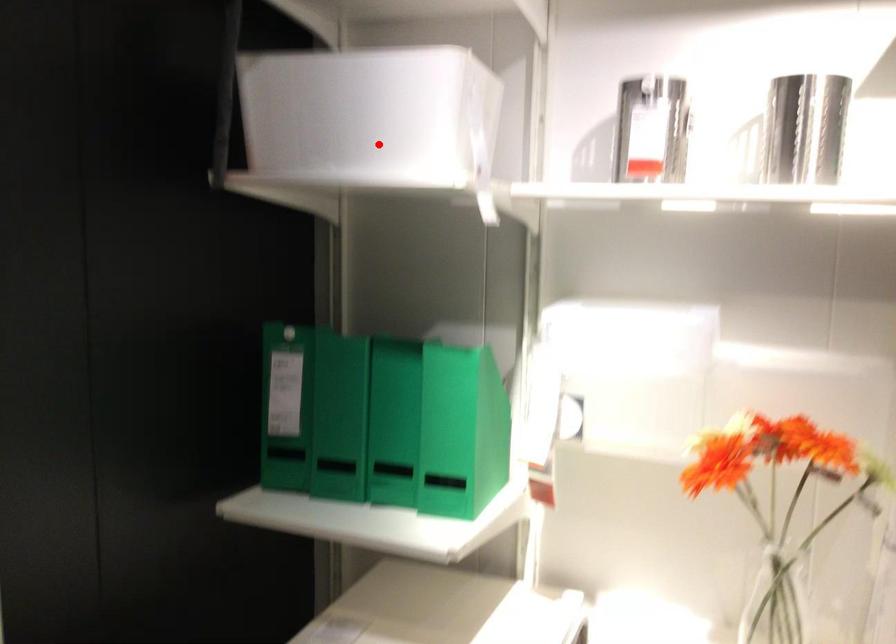
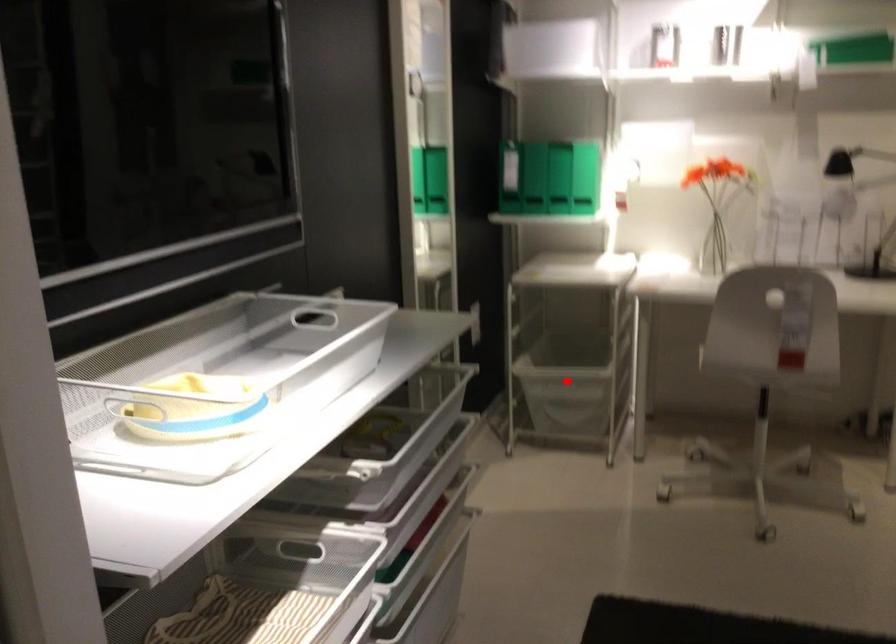
I am providing you with two images of the same scene from different viewpoints. A red point is marked on the first image and another point is marked on the second image. Are the points marked in image1 and image2 representing the same 3D position?

No